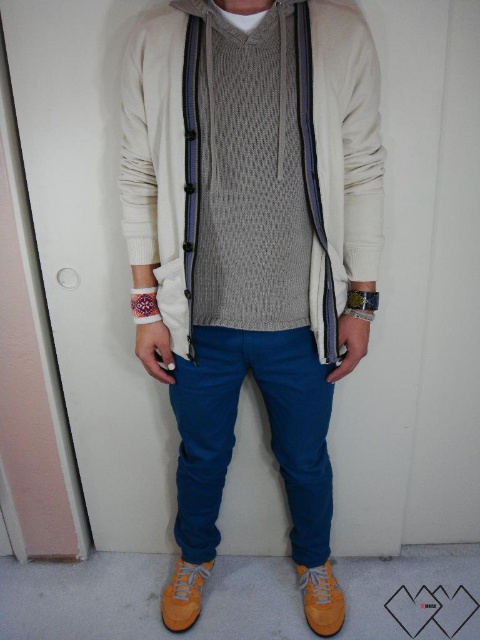
Which is more to the left, suede shoes at lower center or yellow suede shoe at lower center?

suede shoes at lower center

Is suede shoes at lower center bigger than yellow suede shoe at lower center?

Correct, suede shoes at lower center is larger in size than yellow suede shoe at lower center.

The width and height of the screenshot is (480, 640). What are the coordinates of `suede shoes at lower center` in the screenshot? It's located at (252, 234).

Between point (256, 269) and point (311, 582), which one is positioned behind?

The point (311, 582) is behind.

Which is in front, point (213, 138) or point (320, 621)?

Point (213, 138) is in front.

This screenshot has width=480, height=640. Identify the location of knitted gray vest at center. click(244, 172).

Who is more distant from viewer, (288, 396) or (206, 568)?

The point (206, 568) is more distant.

The height and width of the screenshot is (640, 480). Describe the element at coordinates (252, 234) in the screenshot. I see `suede shoes at lower center` at that location.

In order to click on suede shoes at lower center in this screenshot , I will do `click(252, 234)`.